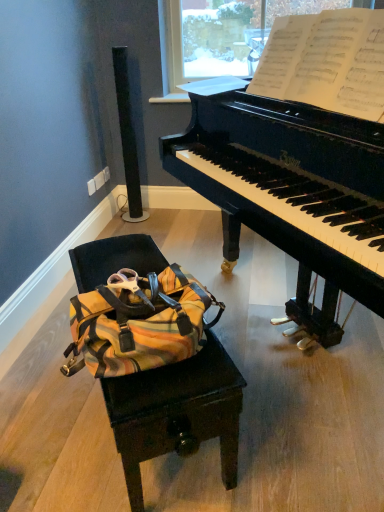
Image resolution: width=384 pixels, height=512 pixels. In order to click on free space to the right of leather-like black table at lower left in this screenshot , I will do `click(294, 389)`.